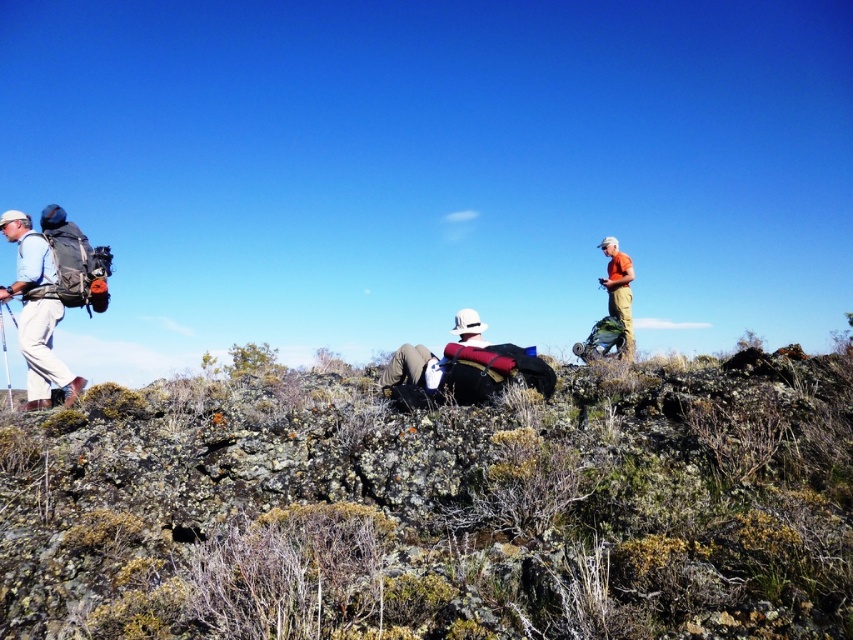
You are planning to place a small flag on the highest point between the green mossy rock at center and the matte black backpack at left. Based on their positions, which object should you choose to place the flag on?

The matte black backpack at left is higher than the green mossy rock at center, so you should place the flag on the matte black backpack at left.

You are planning to take a photo of the matte black backpack at left and the orange fabric shirt at upper right. Which object should you focus on first if you want to capture both in a single frame without moving the camera?

You should focus on the matte black backpack at left first because it is lower in the frame than the orange fabric shirt at upper right, allowing both to be included in the same shot without adjusting the camera position.